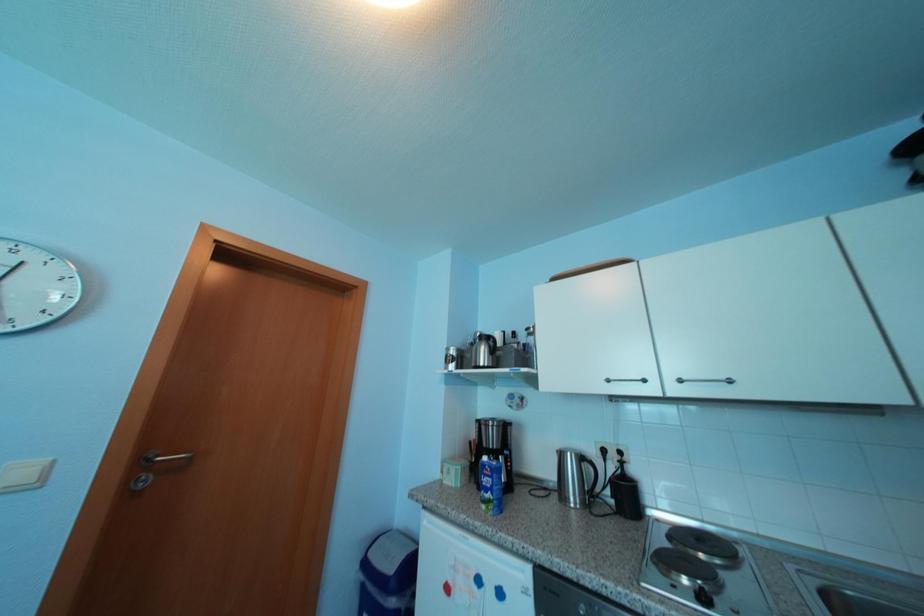
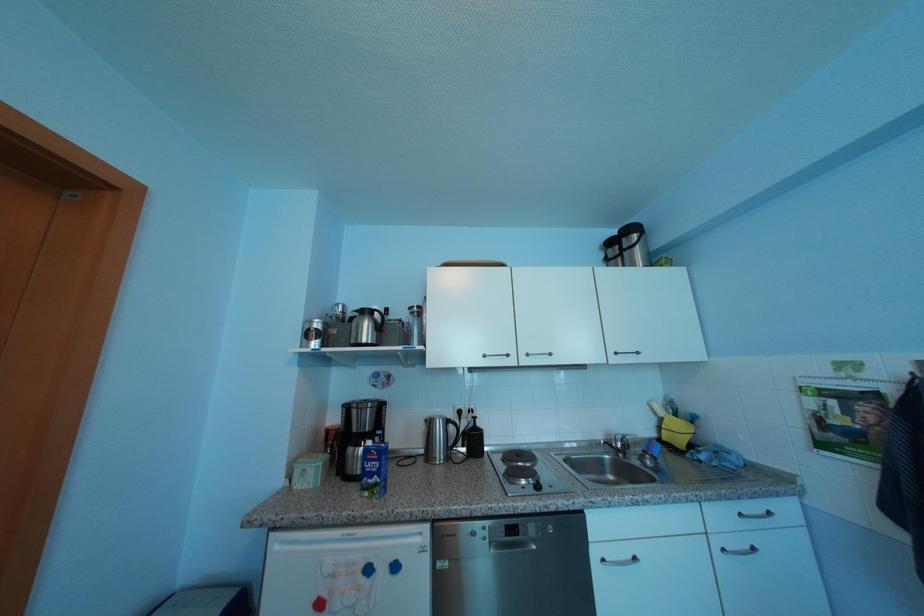
Question: The first image is from the beginning of the video and the second image is from the end. How did the camera likely rotate when shooting the video?

Choices:
 (A) Left
 (B) Right
 (C) Up
 (D) Down

Answer: (B)